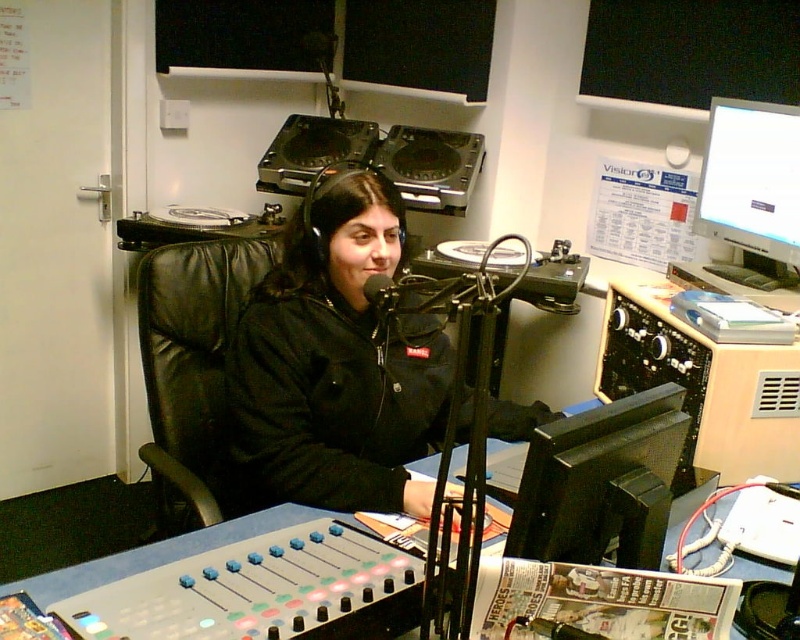
Question: Is black leather chair at center positioned at the back of black glossy monitor at center?

Choices:
 (A) no
 (B) yes

Answer: (B)

Question: Which point is closer to the camera taking this photo?

Choices:
 (A) (633, 400)
 (B) (48, 525)
 (C) (234, 442)
 (D) (700, 195)

Answer: (A)

Question: Is black matte jacket at center smaller than black leather chair at center?

Choices:
 (A) yes
 (B) no

Answer: (B)

Question: Among these objects, which one is nearest to the camera?

Choices:
 (A) black glossy monitor at center
 (B) blue plastic table at center
 (C) black leather chair at center
 (D) matte black monitor at upper right

Answer: (A)

Question: Which object appears farthest from the camera in this image?

Choices:
 (A) blue plastic table at center
 (B) matte black monitor at upper right
 (C) black leather chair at center
 (D) black matte jacket at center

Answer: (A)

Question: Can you confirm if black leather chair at center is wider than blue plastic table at center?

Choices:
 (A) yes
 (B) no

Answer: (B)